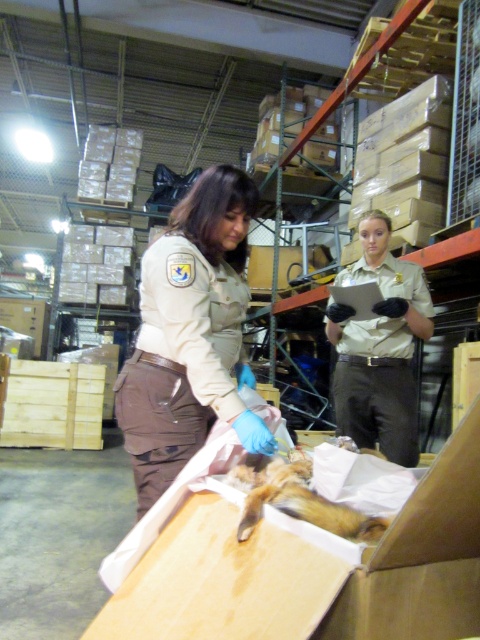
Does tan uniform at center have a lesser width compared to furry brown animal at center?

No, tan uniform at center is not thinner than furry brown animal at center.

Between tan uniform at center and furry brown animal at center, which one is positioned lower?

furry brown animal at center

This screenshot has height=640, width=480. What are the coordinates of `tan uniform at center` in the screenshot? It's located at (381, 356).

Is beige uniform at center above tan uniform at center?

Indeed, beige uniform at center is positioned over tan uniform at center.

How much distance is there between beige uniform at center and tan uniform at center?

3.77 feet

Does point (146, 435) lie in front of point (369, 250)?

Yes, point (146, 435) is in front of point (369, 250).

Where is `beige uniform at center`? Image resolution: width=480 pixels, height=640 pixels. beige uniform at center is located at coordinates (189, 333).

Does beige uniform at center have a lesser height compared to furry brown animal at center?

No.

Image resolution: width=480 pixels, height=640 pixels. Describe the element at coordinates (189, 333) in the screenshot. I see `beige uniform at center` at that location.

Locate an element on the screen. This screenshot has width=480, height=640. beige uniform at center is located at coordinates (189, 333).